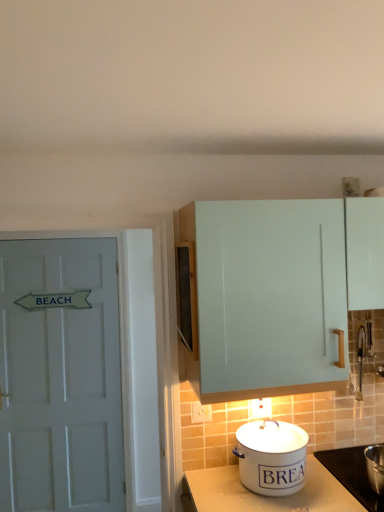
Question: Does point (334, 474) appear closer or farther from the camera than point (297, 457)?

Choices:
 (A) closer
 (B) farther

Answer: (B)

Question: From a real-world perspective, relative to white enamel bread bin at lower center, is white enamel pot at lower right vertically above or below?

Choices:
 (A) below
 (B) above

Answer: (A)

Question: Estimate the real-world distances between objects in this image. Which object is farther from the white painted wood door at left?

Choices:
 (A) white enamel pot at lower right
 (B) light blue matte cabinet at upper right
 (C) white enamel bread bin at lower center

Answer: (A)

Question: Which object is the closest to the light blue matte cabinet at upper right?

Choices:
 (A) white enamel pot at lower right
 (B) white painted wood door at left
 (C) white enamel bread bin at lower center

Answer: (C)